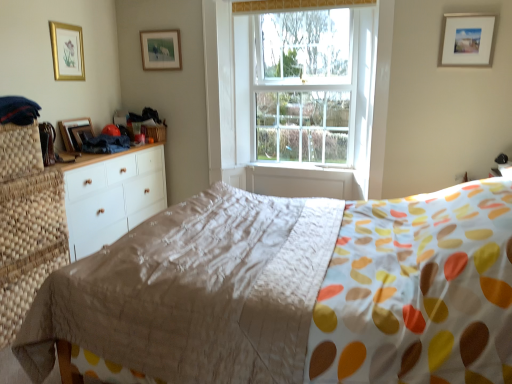
Question: From the image's perspective, relative to wooden picture frame at left, the 2th picture frame from the left, is gold-framed picture at upper left, the fourth picture frame when ordered from right to left, above or below?

Choices:
 (A) above
 (B) below

Answer: (A)

Question: In terms of width, does gold-framed picture at upper left, the fourth picture frame when ordered from right to left, look wider or thinner when compared to wooden picture frame at left, which is counted as the 3th picture frame, starting from the right?

Choices:
 (A) thin
 (B) wide

Answer: (A)

Question: Which object is the closest to the matte beige quilt at center?

Choices:
 (A) clear glass window at center
 (B) gold-framed picture at upper left, arranged as the first picture frame when viewed from the left
 (C) white painted wood at center
 (D) matte gold picture frame at upper center, positioned as the second picture frame in right-to-left order
 (E) wooden picture frame at left, which is counted as the 3th picture frame, starting from the right

Answer: (A)

Question: Which is nearer to the white wood chest of drawers at left?

Choices:
 (A) white painted wood at center
 (B) matte beige quilt at center
 (C) wooden picture frame at left, which is counted as the 3th picture frame, starting from the right
 (D) white matte picture frame at upper right, the first picture frame positioned from the right
 (E) clear glass window at center

Answer: (C)